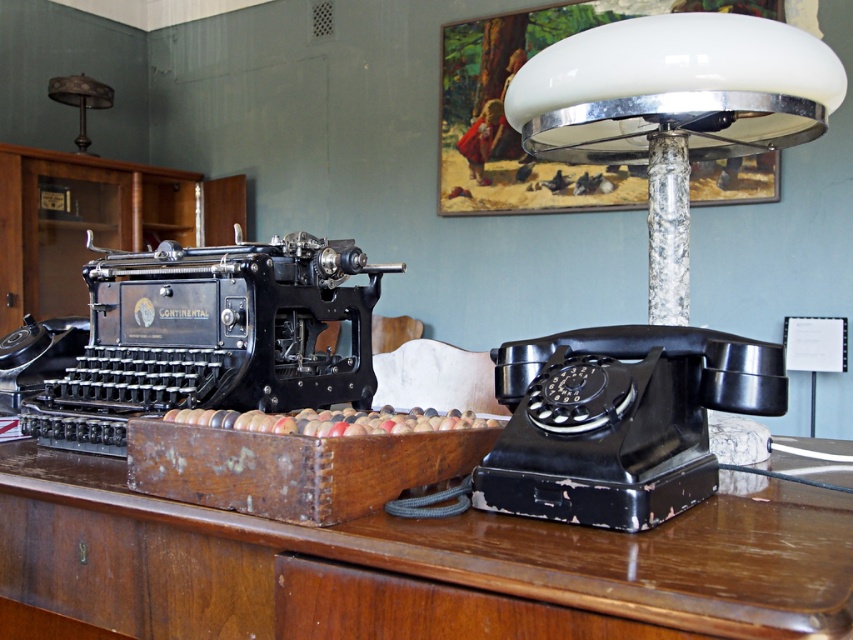
You are a delivery person who needs to place a package on the brown wooden table at center. However, the black matte rotary phone at right is in the way. Can you slide the phone to the side to make space?

The brown wooden table at center is not as tall as black matte rotary phone at right, meaning the phone is taller than the table. Since the phone is already on the table, you cannot slide it to the side because it would fall off the edge of the table.

You are an office worker in the 1920s who needs to place a new memo pad on your desk. The memo pad is exactly the same width as the metallic lampshade at upper left. Will it fit in the space currently occupied by the black matte rotary phone at right?

The black matte rotary phone at right is wider than the metallic lampshade at upper left. Since the memo pad has the same width as the lampshade, it will fit in the space currently occupied by the black matte rotary phone at right.